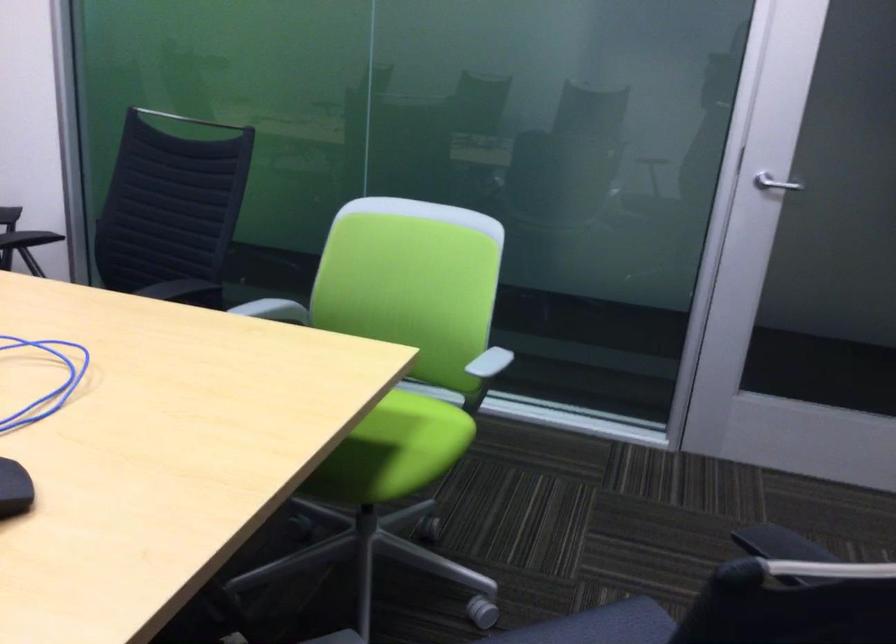
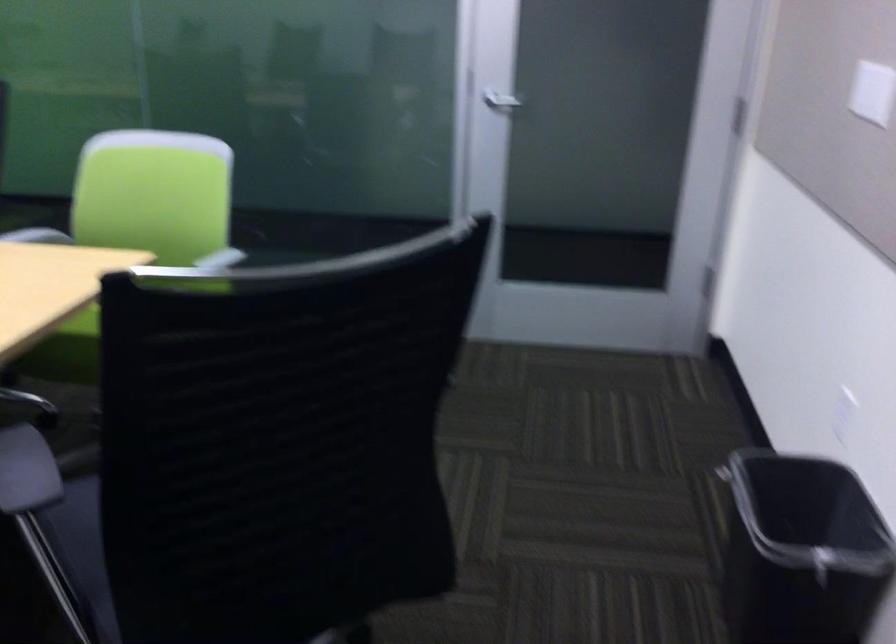
In a continuous first-person perspective shot, in which direction is the camera moving?

The movement direction of the cameraman is right, backward.